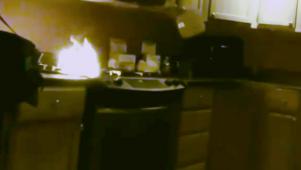
The width and height of the screenshot is (301, 170). I want to click on counter top, so click(x=272, y=80), click(x=48, y=77).